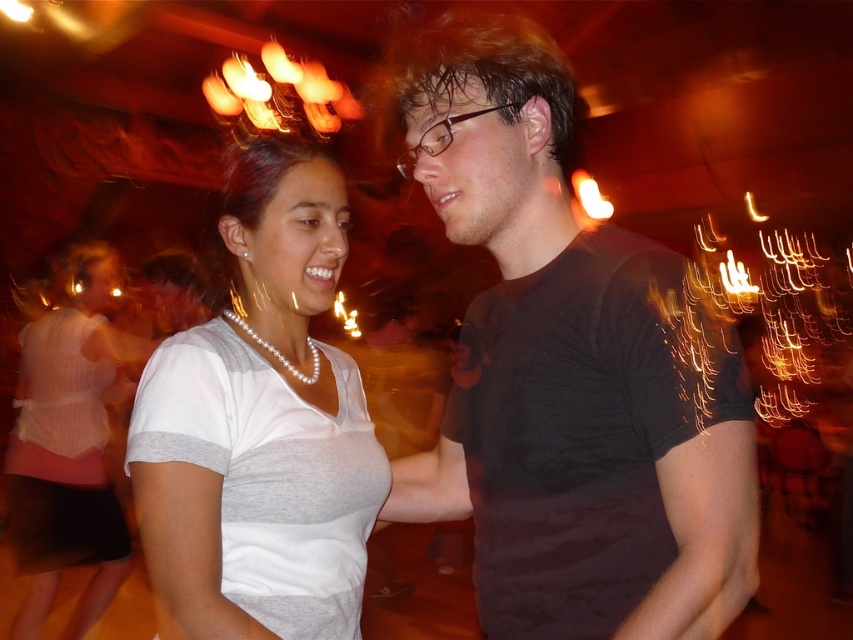
Consider the image. You are a photographer trying to capture a clear shot of the white pearl necklace at center. However, the black matte shirt at center is blocking your view. Can you adjust your angle to see the necklace without moving the objects?

The black matte shirt at center is in front of the white pearl necklace at center, so adjusting your angle might allow you to see around or above the shirt to capture the necklace without moving the objects.

You are organizing a photo album and want to ensure that the black matte shirt at center and the pearl necklace at upper left are placed in order from narrowest to widest. Based on their positions in the image, which should come first?

The black matte shirt at center has a lesser width compared to pearl necklace at upper left, so it should come first in the order from narrowest to widest.